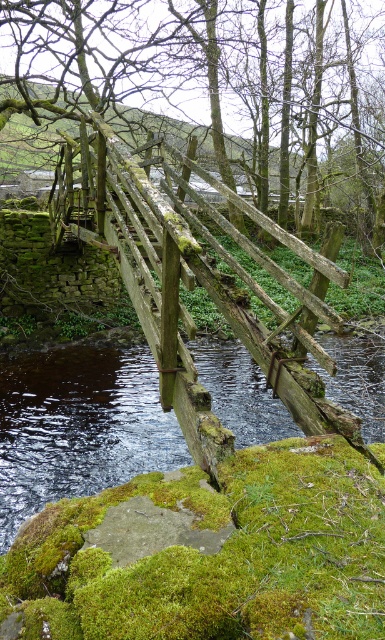
Looking at this image, between black water at center and rusty wood rail at center, which one is positioned higher?

rusty wood rail at center is above.

Describe the element at coordinates (78, 426) in the screenshot. This screenshot has width=385, height=640. I see `black water at center` at that location.

The height and width of the screenshot is (640, 385). I want to click on black water at center, so click(x=78, y=426).

Between point (217, 52) and point (8, 394), which one is positioned in front?

Point (8, 394) is more forward.

Between green mossy tree at center and black water at center, which one appears on the right side from the viewer's perspective?

green mossy tree at center is more to the right.

Between point (274, 22) and point (123, 348), which one is positioned in front?

Point (123, 348)

Find the location of a particular element. The width and height of the screenshot is (385, 640). green mossy tree at center is located at coordinates tap(210, 68).

Is green mossy tree at center positioned behind rusty wood rail at center?

That is False.

Between point (108, 106) and point (319, 388), which one is positioned in front?

Point (319, 388) is more forward.

Identify the location of green mossy tree at center. (210, 68).